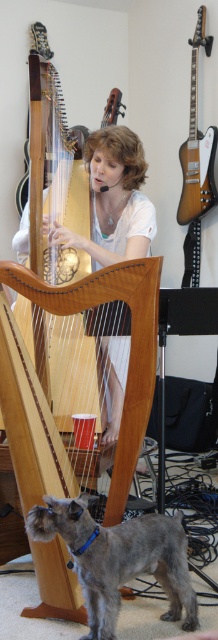
You are a photographer trying to capture the harp player and the dog in the scene. The point at coordinates point (117, 557) is important for your composition. Where exactly on the gray fur dog at lower left is this point located?

The point (117, 557) is located on the gray fur dog at lower left.